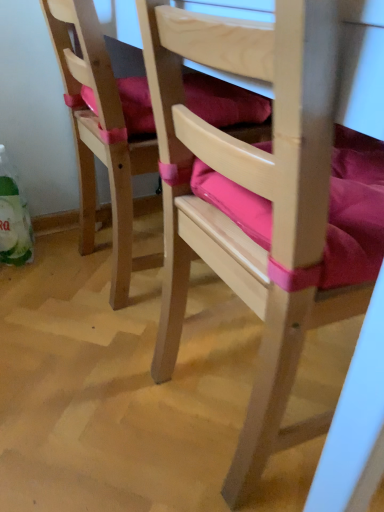
Locate an element on the screen. The image size is (384, 512). vacant space to the left of pink fabric cushion at left, which is the 1th chair in left-to-right order is located at coordinates (41, 273).